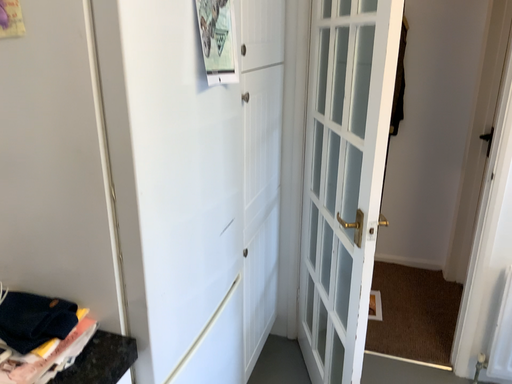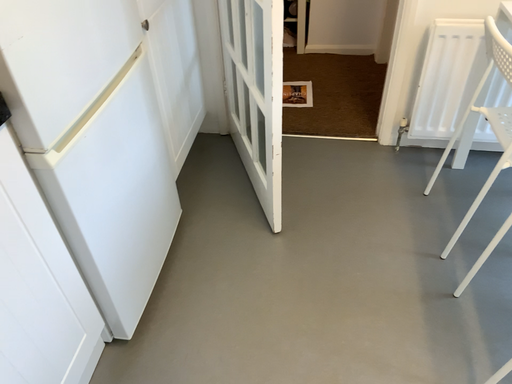
Question: Which way did the camera rotate in the video?

Choices:
 (A) rotated right
 (B) rotated left

Answer: (A)